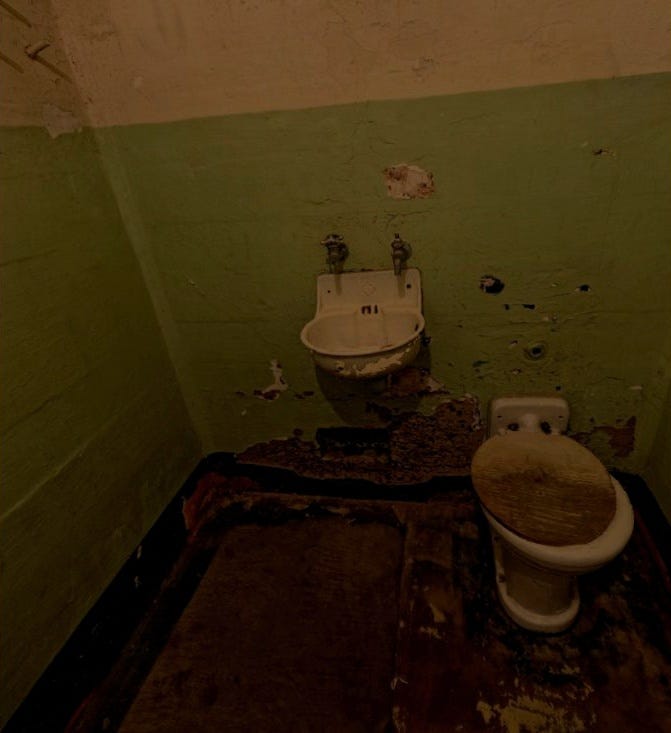
The width and height of the screenshot is (671, 733). I want to click on right handle, so click(x=399, y=245).